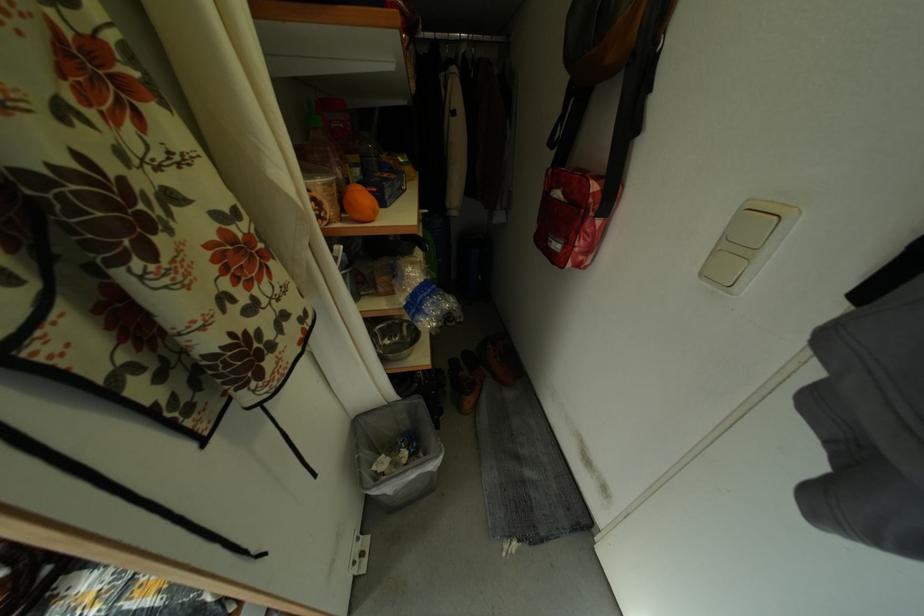
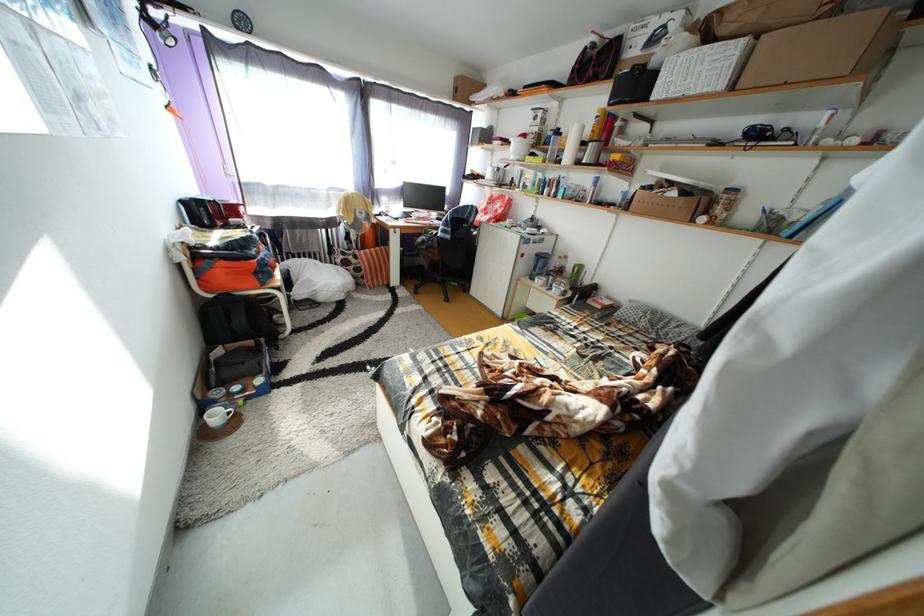
Question: The camera is either moving clockwise (left) or counter-clockwise (right) around the object. The first image is from the beginning of the video and the second image is from the end. Is the camera moving left or right when shooting the video?

Choices:
 (A) Left
 (B) Right

Answer: (B)